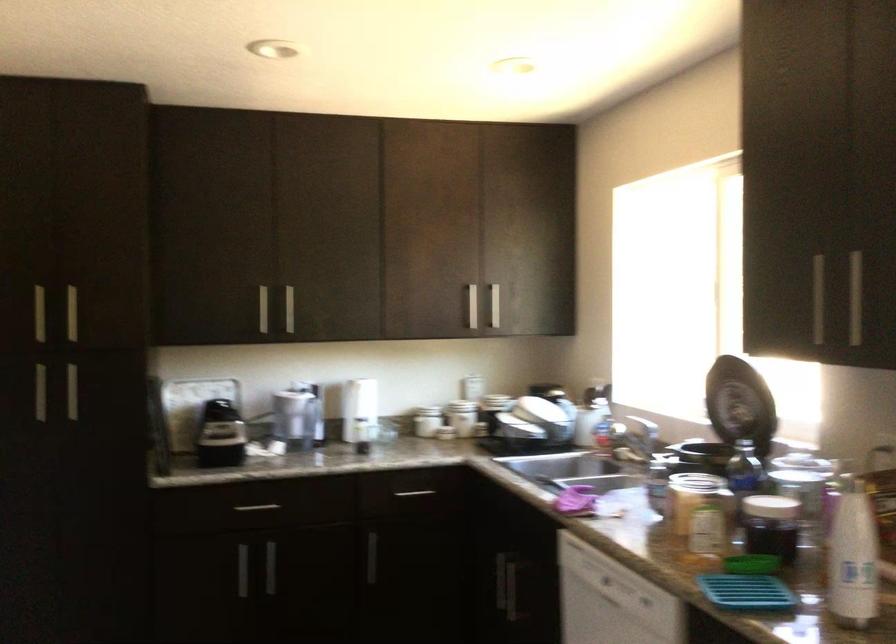
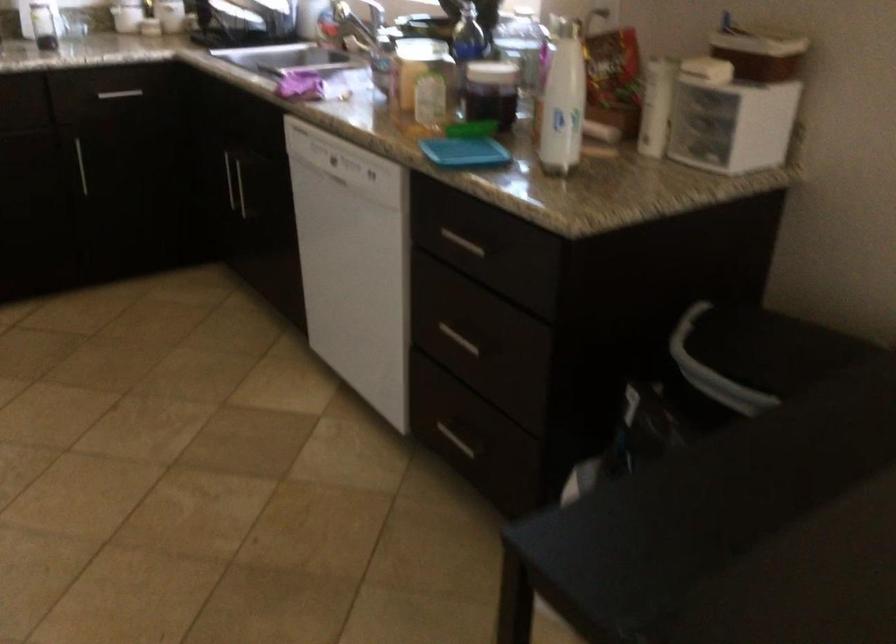
The point at (700,516) is marked in the first image. Where is the corresponding point in the second image?

(421, 84)